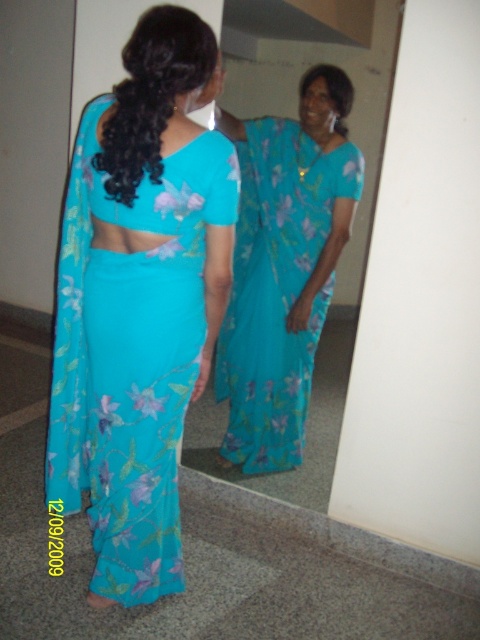
Question: Which point appears closest to the camera in this image?

Choices:
 (A) (167, 556)
 (B) (289, 243)

Answer: (A)

Question: Which point appears closest to the camera in this image?

Choices:
 (A) (84, 464)
 (B) (256, 305)

Answer: (A)

Question: Does matte blue sari at back appear under blue floral saree at center?

Choices:
 (A) yes
 (B) no

Answer: (A)

Question: Can you confirm if matte blue sari at back is positioned above blue floral saree at center?

Choices:
 (A) yes
 (B) no

Answer: (B)

Question: Is matte blue sari at back further to camera compared to blue floral saree at center?

Choices:
 (A) no
 (B) yes

Answer: (A)